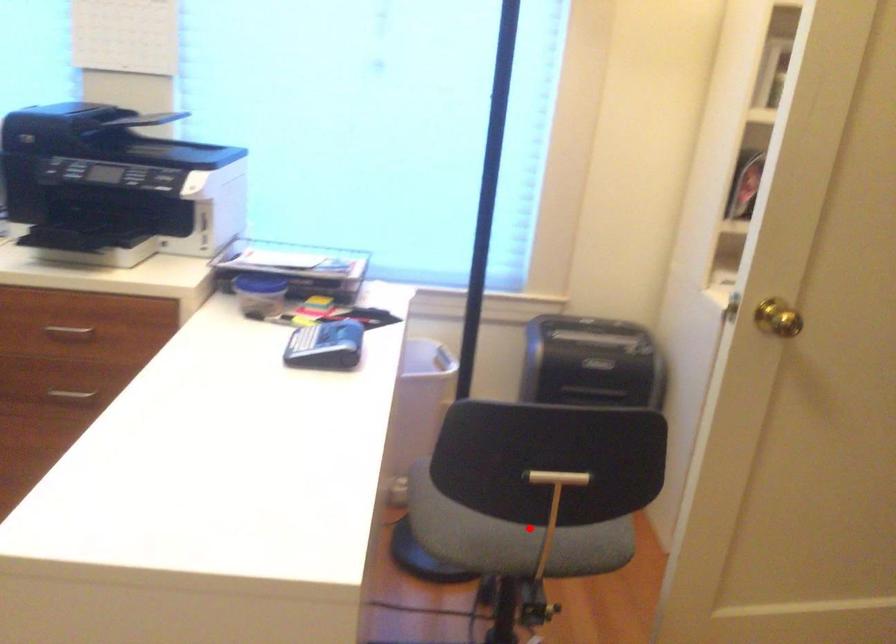
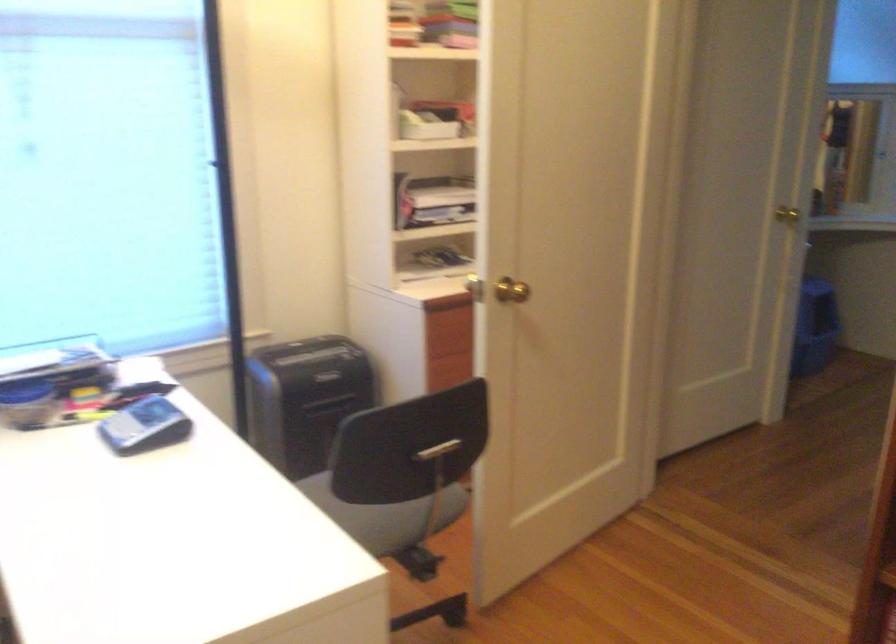
Find the pixel in the second image that matches the highlighted location in the first image.

(383, 515)